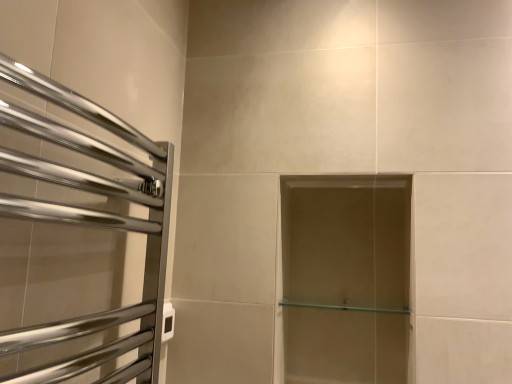
Question: Considering the relative positions of clear glass shelf at center and polished chrome towel rack at left in the image provided, is clear glass shelf at center to the right of polished chrome towel rack at left from the viewer's perspective?

Choices:
 (A) no
 (B) yes

Answer: (B)

Question: Is clear glass shelf at center taller than polished chrome towel rack at left?

Choices:
 (A) no
 (B) yes

Answer: (A)

Question: From a real-world perspective, is clear glass shelf at center on polished chrome towel rack at left?

Choices:
 (A) yes
 (B) no

Answer: (B)

Question: Does clear glass shelf at center have a smaller size compared to polished chrome towel rack at left?

Choices:
 (A) no
 (B) yes

Answer: (B)

Question: Does clear glass shelf at center have a larger size compared to polished chrome towel rack at left?

Choices:
 (A) yes
 (B) no

Answer: (B)

Question: From a real-world perspective, is clear glass shelf at center beneath polished chrome towel rack at left?

Choices:
 (A) yes
 (B) no

Answer: (A)

Question: Considering the relative positions of polished chrome towel rack at left and clear glass shelf at center in the image provided, is polished chrome towel rack at left to the right of clear glass shelf at center from the viewer's perspective?

Choices:
 (A) yes
 (B) no

Answer: (B)

Question: From the image's perspective, is polished chrome towel rack at left on top of clear glass shelf at center?

Choices:
 (A) no
 (B) yes

Answer: (B)

Question: Is polished chrome towel rack at left outside of clear glass shelf at center?

Choices:
 (A) no
 (B) yes

Answer: (B)

Question: Does polished chrome towel rack at left have a lesser height compared to clear glass shelf at center?

Choices:
 (A) yes
 (B) no

Answer: (B)

Question: Does polished chrome towel rack at left have a greater width compared to clear glass shelf at center?

Choices:
 (A) yes
 (B) no

Answer: (B)

Question: From a real-world perspective, is polished chrome towel rack at left on top of clear glass shelf at center?

Choices:
 (A) yes
 (B) no

Answer: (A)

Question: In terms of size, does clear glass shelf at center appear bigger or smaller than polished chrome towel rack at left?

Choices:
 (A) big
 (B) small

Answer: (B)